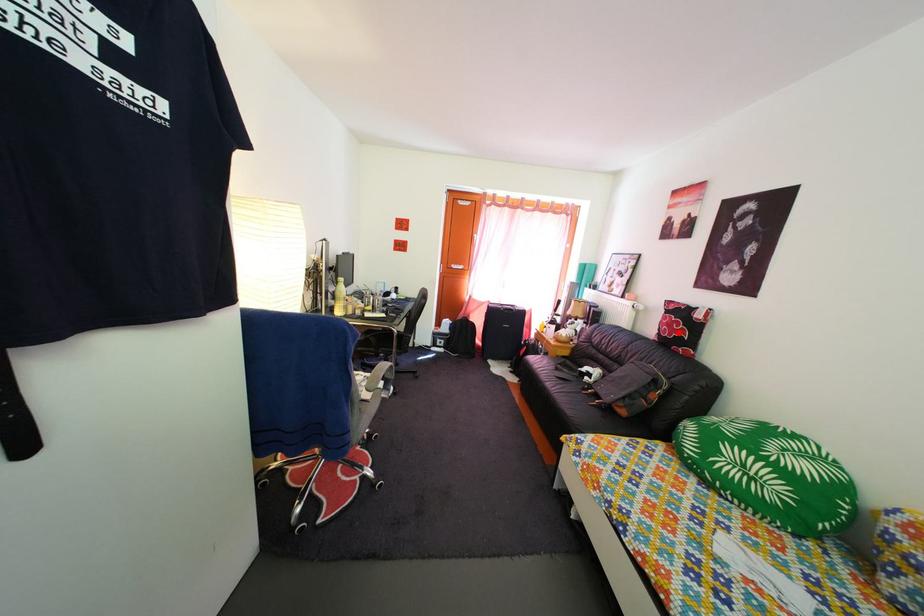
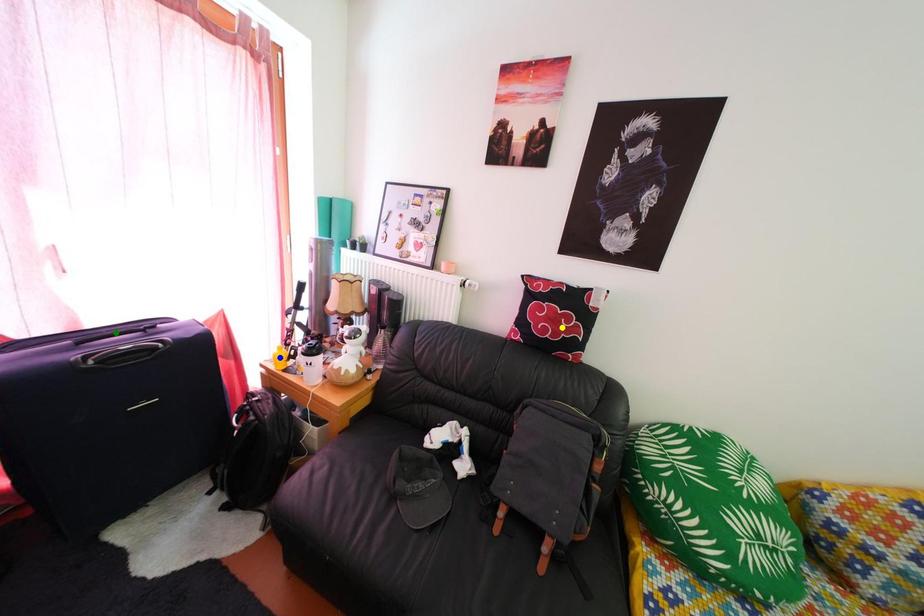
Question: I am providing you with two images of the same scene from different viewpoints. A red point is marked on the first image. You are given multiple points on the second image. Which point in image 2 represents the same 3d spot as the red point in image 1?

Choices:
 (A) green point
 (B) yellow point
 (C) blue point

Answer: (B)